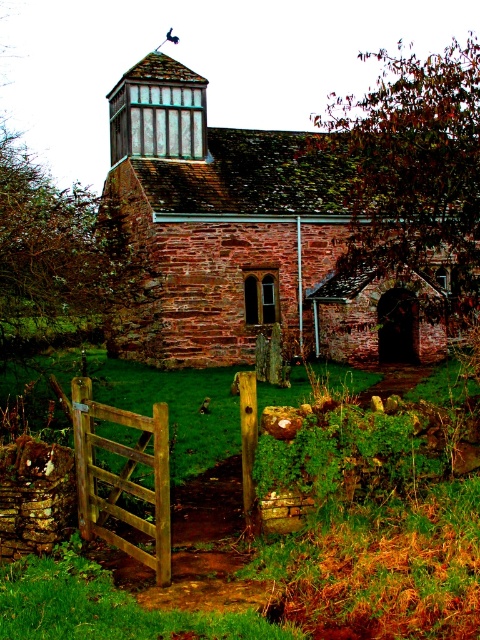
Question: Which point is farther from the camera taking this photo?

Choices:
 (A) (463, 61)
 (B) (327, 113)
 (C) (162, 426)

Answer: (B)

Question: Does brown brick church at center appear under brown leafy tree at upper right?

Choices:
 (A) no
 (B) yes

Answer: (A)

Question: Which object appears farthest from the camera in this image?

Choices:
 (A) wooden gate at lower left
 (B) brown brick church at center
 (C) brown leafy tree at upper right

Answer: (C)

Question: Where is brown brick church at center located in relation to brown leafy tree at upper right in the image?

Choices:
 (A) above
 (B) below

Answer: (A)

Question: Is brown brick church at center in front of wooden gate at lower left?

Choices:
 (A) yes
 (B) no

Answer: (B)

Question: Which point is closer to the camera?

Choices:
 (A) (116, 515)
 (B) (442, 211)

Answer: (A)